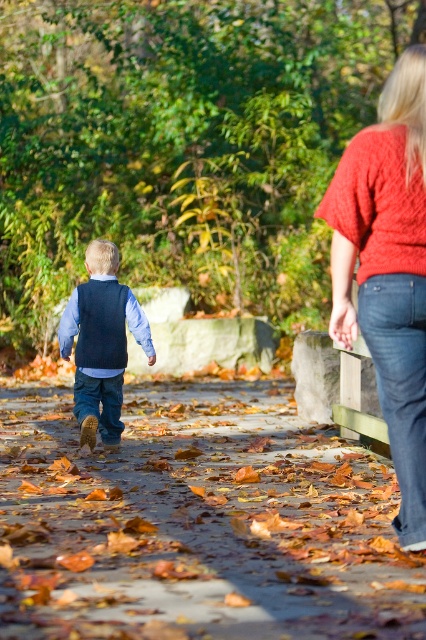
You are a photographer trying to capture the child walking away on the leaves carpeted path at center. To include both the child and the knitted red sweater at upper right in the same frame, should you adjust your camera angle upwards or downwards?

The leaves carpeted path at center is below the knitted red sweater at upper right. To include both in the frame, you should adjust your camera angle upwards to capture the knitted red sweater at upper right while still framing the child on the leaves carpeted path at center.

In the autumn scene, there is a knitted red sweater at upper right and a denim vest at center. Which object is positioned to the right of the other?

The knitted red sweater at upper right is to the right of the denim vest at center.